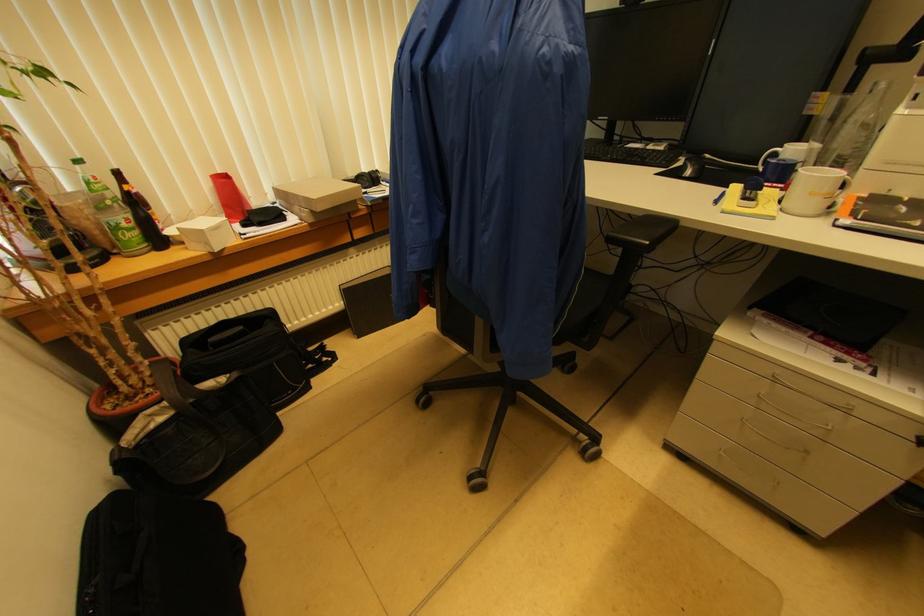
You are a GUI agent. You are given a task and a screenshot of the screen. Output one action in this format:
    pyautogui.click(x=<x>, y=<y>)
    Task: Click on the dark glass bottle
    The image size is (924, 616).
    Given the screenshot: What is the action you would take?
    pyautogui.click(x=140, y=213)